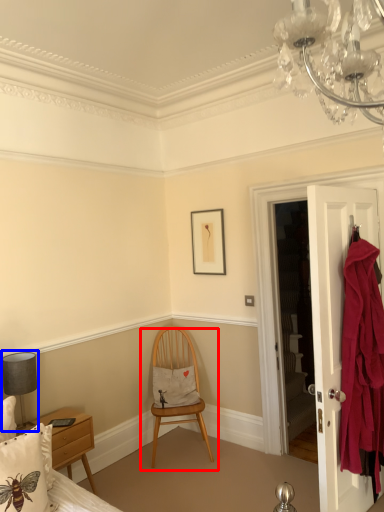
Question: Which object is further to the camera taking this photo, chair (highlighted by a red box) or lamp (highlighted by a blue box)?

Choices:
 (A) chair
 (B) lamp

Answer: (A)